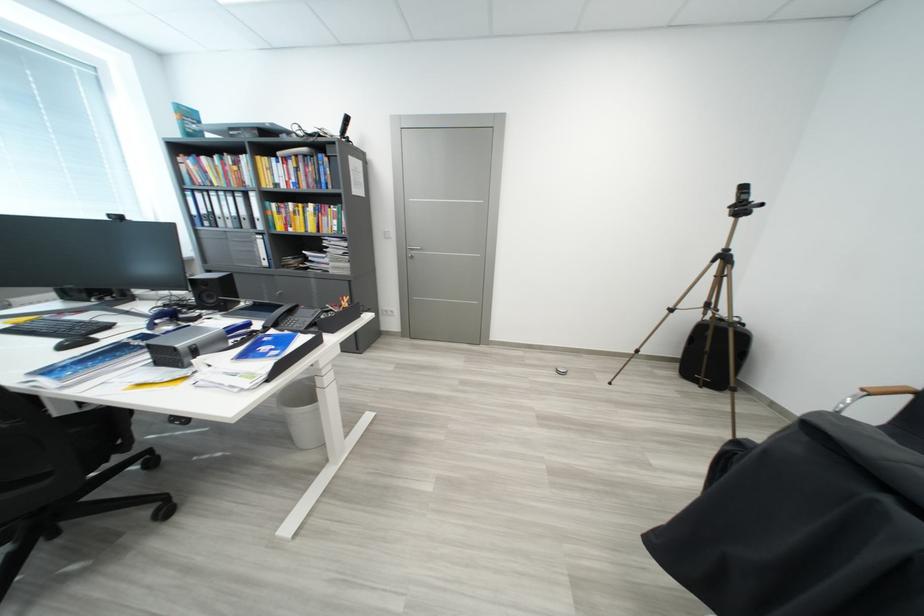
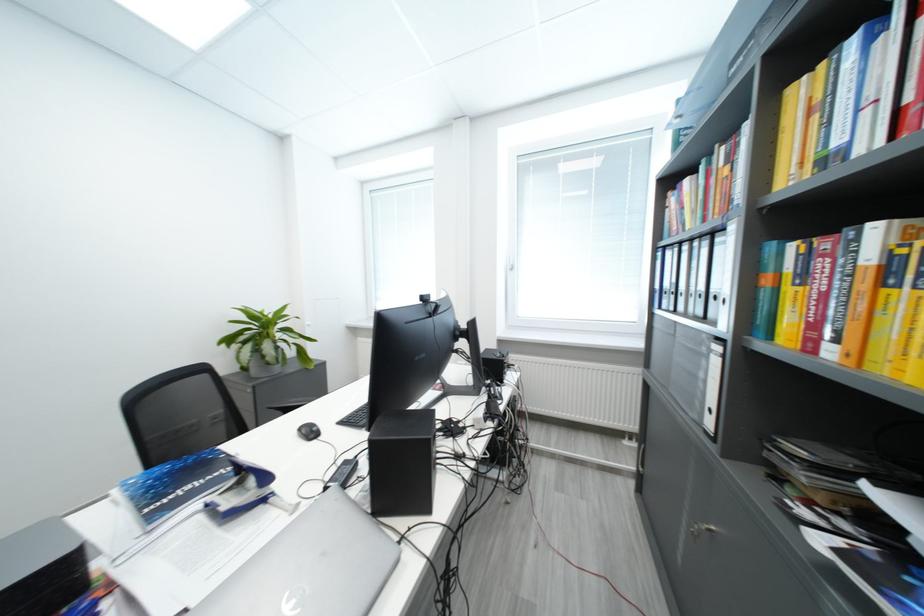
Find the pixel in the second image that matches (x=213, y=161) in the first image.

(696, 184)